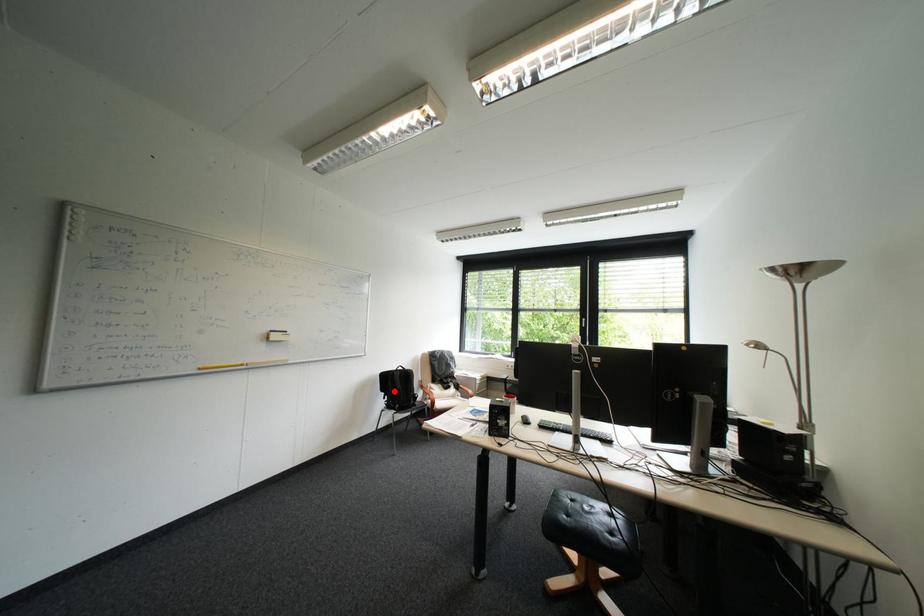
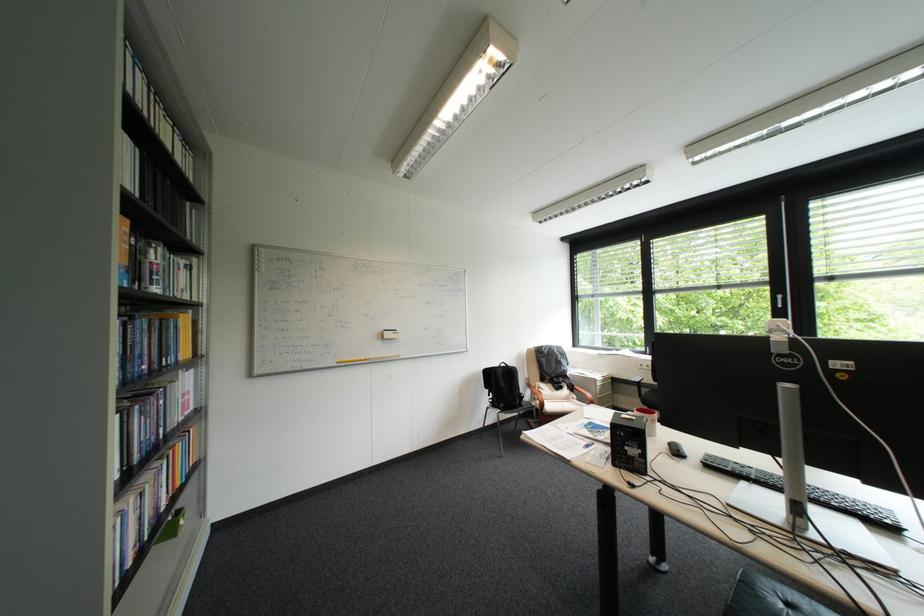
Locate, in the second image, the point that corresponds to the highlighted location in the first image.

(497, 387)